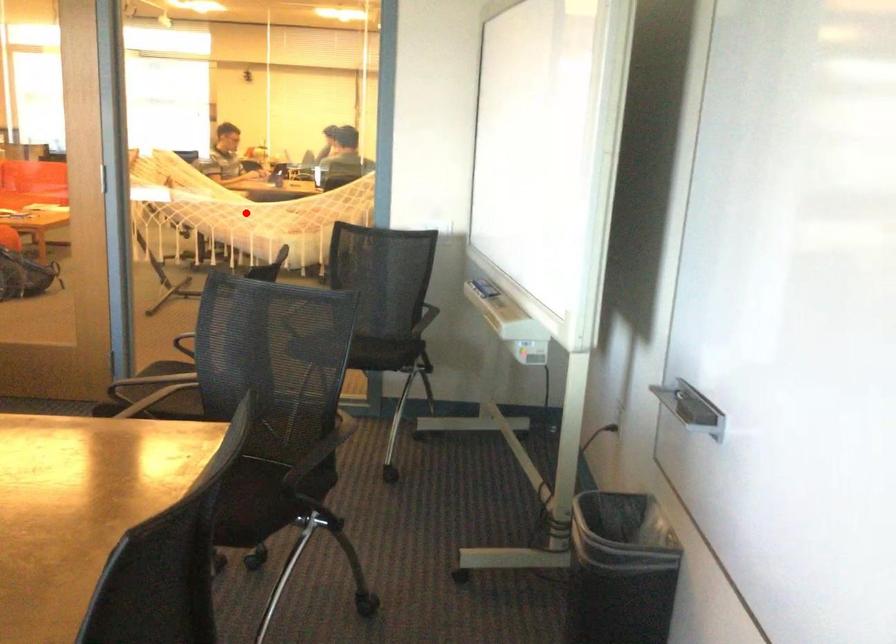
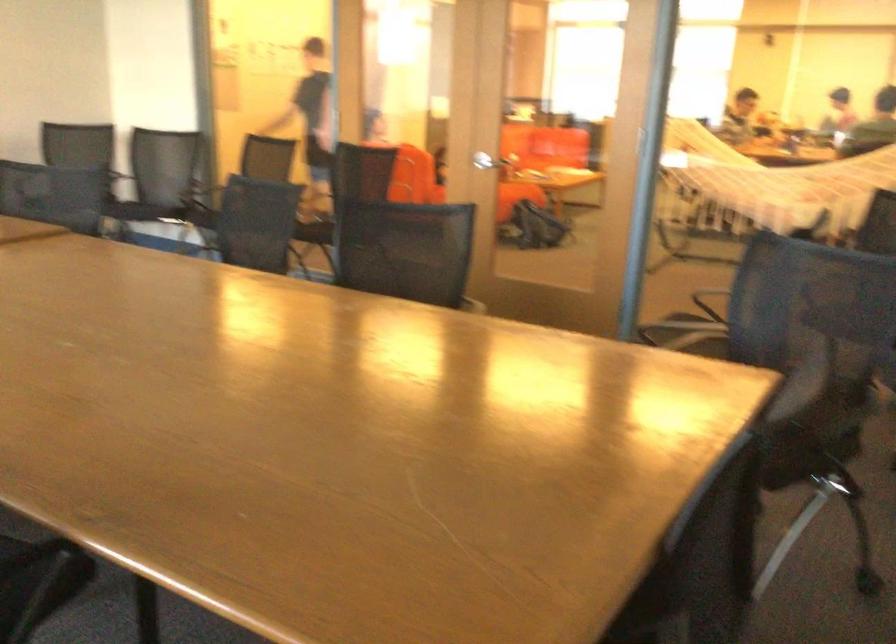
Question: I am providing you with two images of the same scene from different viewpoints. A red point is marked on the first image. Can you still see the location of the red point in image 2?

Choices:
 (A) Yes
 (B) No

Answer: (B)